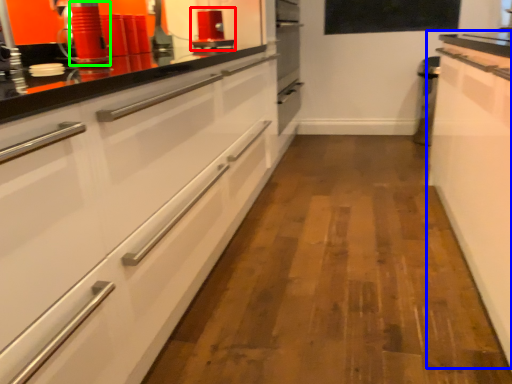
Question: Which is farther away from appliance (highlighted by a red box)? cabinetry (highlighted by a blue box) or appliance (highlighted by a green box)?

Choices:
 (A) cabinetry
 (B) appliance

Answer: (A)